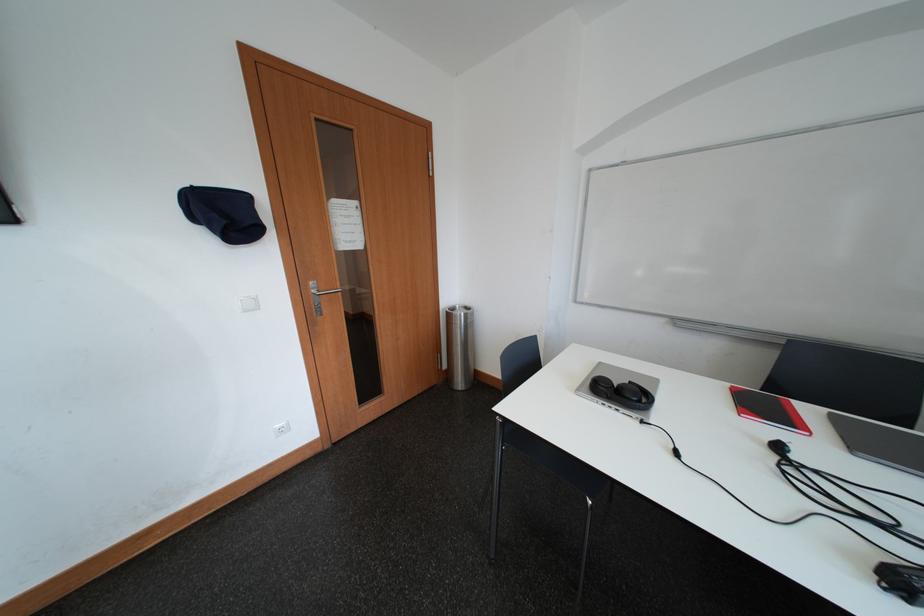
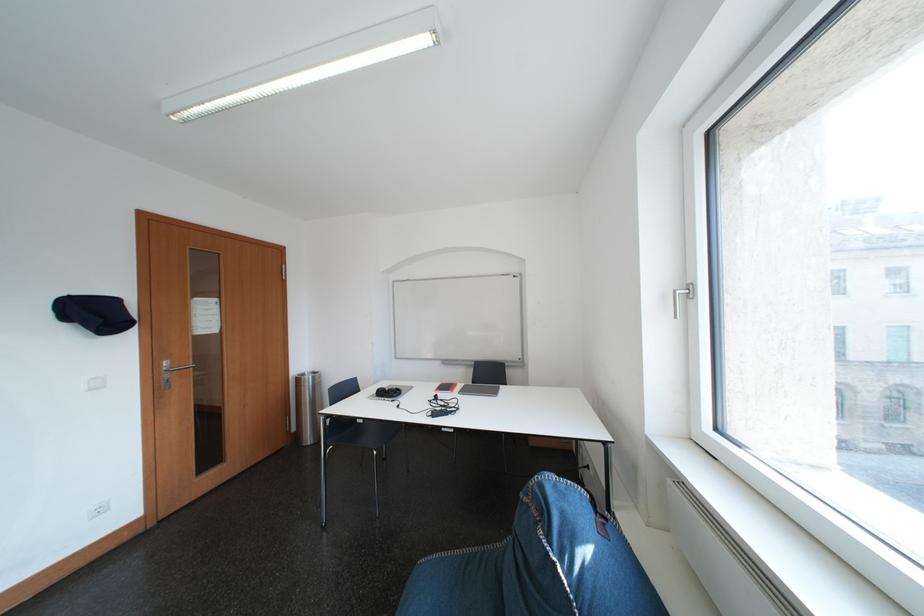
Locate, in the second image, the point that corresponds to point (459, 318) in the first image.

(310, 383)